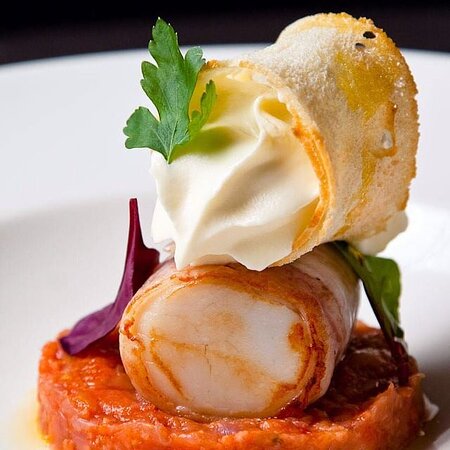
Identify the location of plate. The image size is (450, 450). (65, 245).